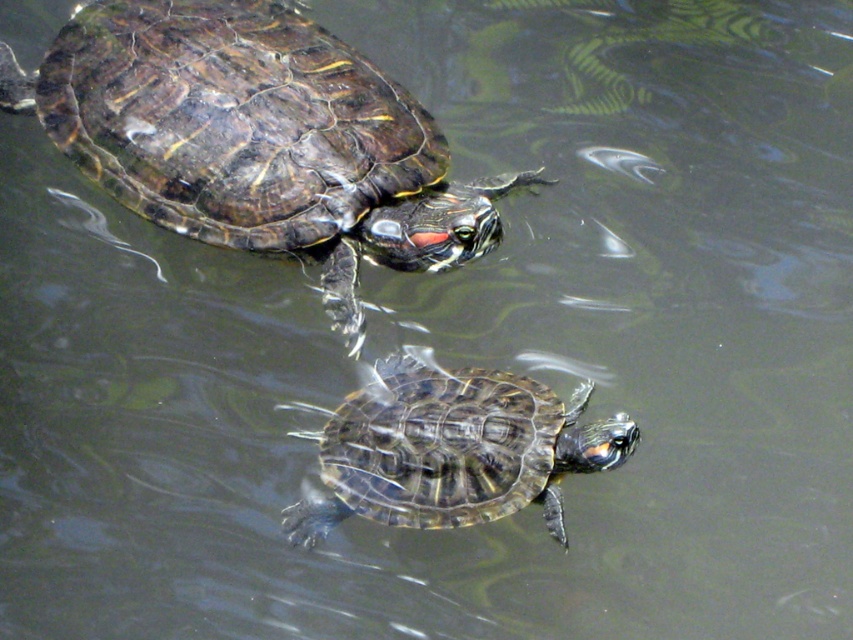
Which is below, shiny dark green tortoise at upper left or shiny brown tortoise at center?

shiny brown tortoise at center is lower down.

Based on the photo, who is more distant from viewer, (451, 209) or (386, 516)?

The point (451, 209) is behind.

Does point (79, 72) come farther from viewer compared to point (555, 461)?

Yes, it is.

The width and height of the screenshot is (853, 640). I want to click on shiny dark green tortoise at upper left, so click(257, 138).